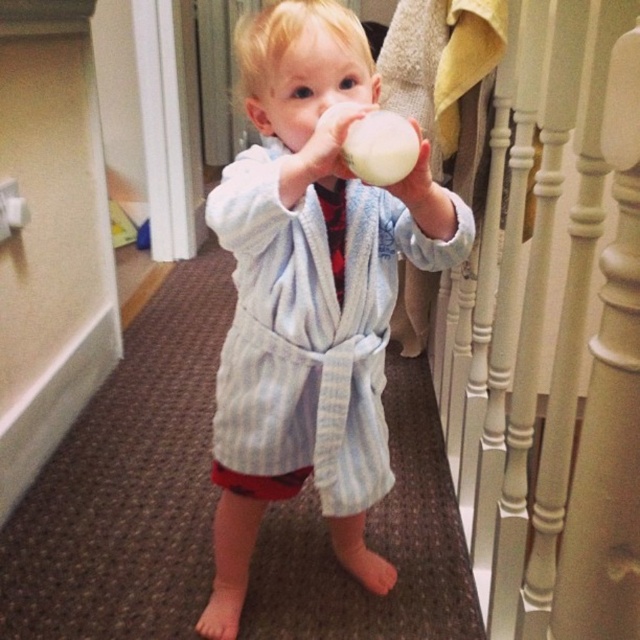
Question: Where is white painted wood at right located in relation to light blue striped robe at center in the image?

Choices:
 (A) below
 (B) above

Answer: (B)

Question: Which of the following is the closest to the observer?

Choices:
 (A) (589, 515)
 (B) (355, 93)

Answer: (A)

Question: Among these points, which one is farthest from the camera?

Choices:
 (A) (589, 413)
 (B) (252, 26)

Answer: (B)

Question: Is white painted wood at right to the right of light blue striped robe at center from the viewer's perspective?

Choices:
 (A) no
 (B) yes

Answer: (B)

Question: Can you confirm if white painted wood at right is positioned to the right of light blue striped robe at center?

Choices:
 (A) no
 (B) yes

Answer: (B)